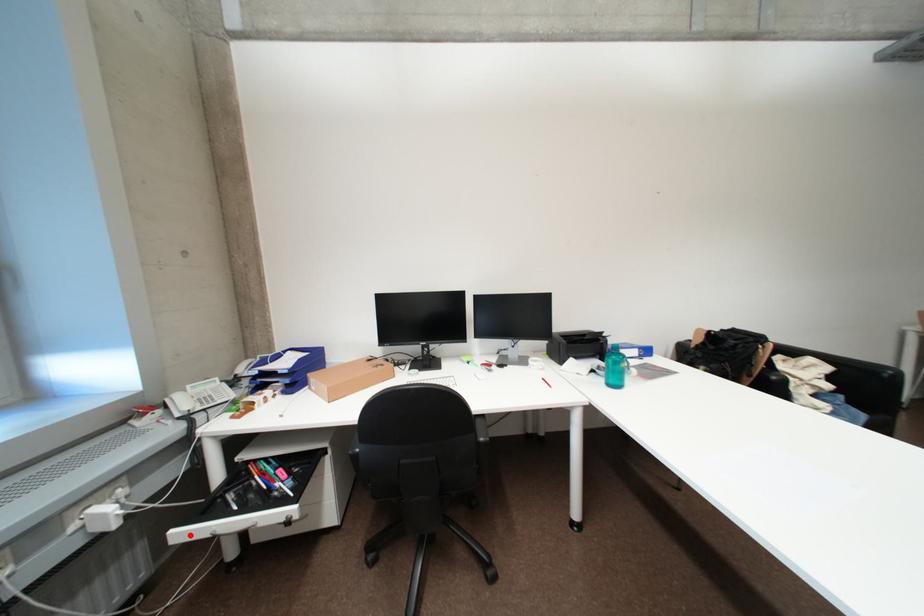
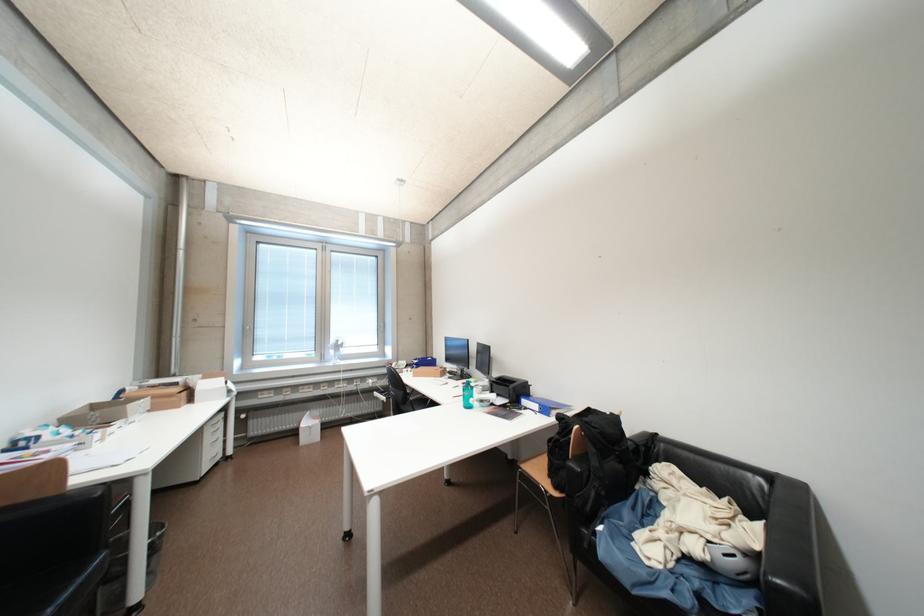
Question: I am providing you with two images of the same scene from different viewpoints. Image1 has a red point marked. In image2, the corresponding 3D location appears at what relative position? Reply with the corresponding letter.

Choices:
 (A) Closer
 (B) Farther

Answer: (B)